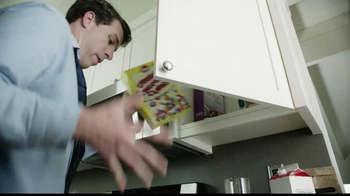
Find the location of a particular element. metal knob is located at coordinates (171, 66).